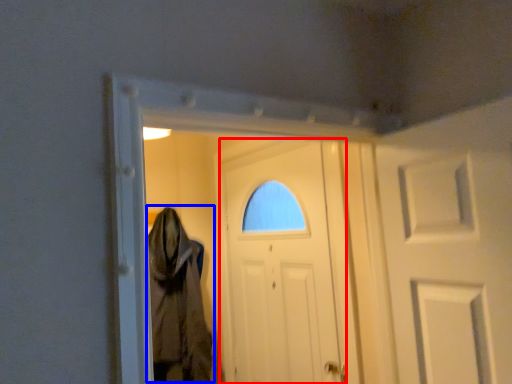
Question: Among these objects, which one is farthest to the camera, door (highlighted by a red box) or cloak (highlighted by a blue box)?

Choices:
 (A) door
 (B) cloak

Answer: (B)